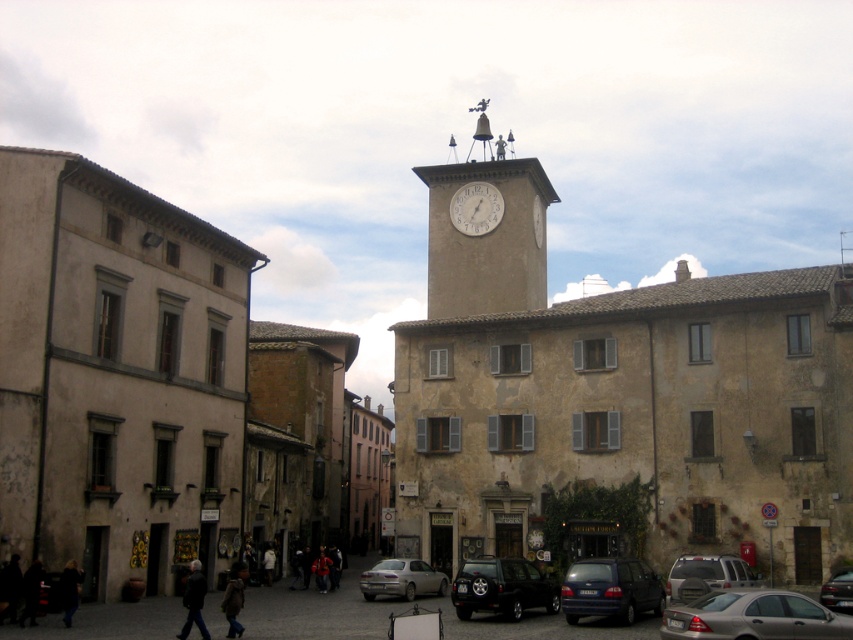
You are a tourist standing in the town square and want to take a photo of the white matte clock at upper center. There is a matte gray suv at center blocking your view. Can you see the clock over the suv?

The matte gray suv at center is located below the white matte clock at upper center, so yes, you can see the clock over the suv since it is positioned higher up.